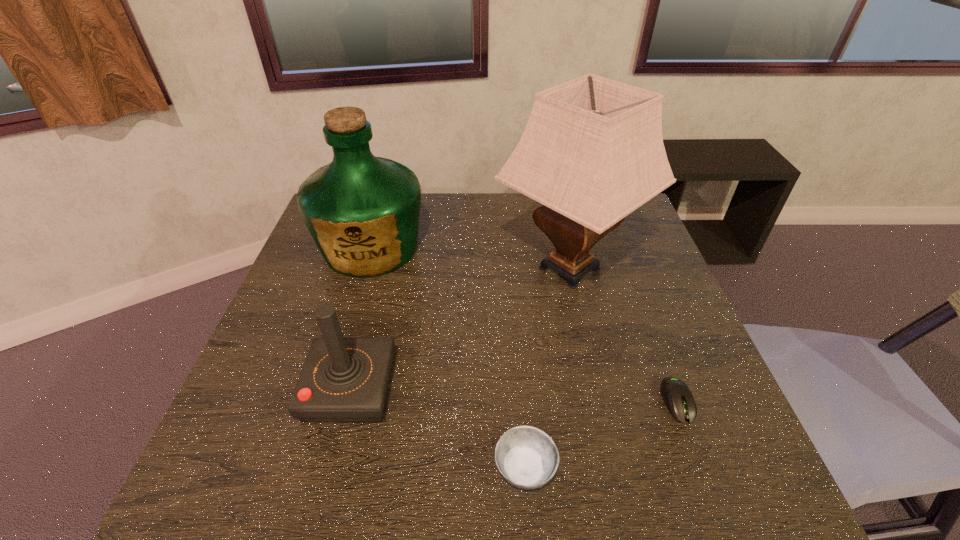
At what (x,y) coordinates should I click in order to perform the action: click on free space between the tallest object and the ashtray. Please return your answer as a coordinate pair (x, y). Looking at the image, I should click on (547, 368).

This screenshot has height=540, width=960. In order to click on free space between the shortest object and the ashtray in this screenshot , I will do `click(601, 435)`.

I want to click on unoccupied position between the ashtray and the lampshade, so click(x=547, y=368).

Locate an element on the screen. The image size is (960, 540). empty space between the joystick and the second shortest object is located at coordinates (438, 429).

This screenshot has height=540, width=960. I want to click on unoccupied area between the tallest object and the joystick, so click(460, 328).

The width and height of the screenshot is (960, 540). In order to click on object that stands as the fourth closest to the shortest object in this screenshot , I will do `click(362, 211)`.

Image resolution: width=960 pixels, height=540 pixels. Find the location of `object that is the second closest to the shortest object`. object that is the second closest to the shortest object is located at coordinates (526, 457).

Find the location of a particular element. This screenshot has width=960, height=540. vacant space that satisfies the following two spatial constraints: 1. on the label side of the ashtray; 2. on the right side of the fourth shortest object is located at coordinates (306, 468).

I want to click on vacant space that satisfies the following two spatial constraints: 1. on the label side of the liquor; 2. on the left side of the nearest object, so click(306, 468).

Image resolution: width=960 pixels, height=540 pixels. What are the coordinates of `vacant space that satisfies the following two spatial constraints: 1. on the front side of the lampshade; 2. on the rectangular base of the third tallest object` in the screenshot? It's located at (597, 389).